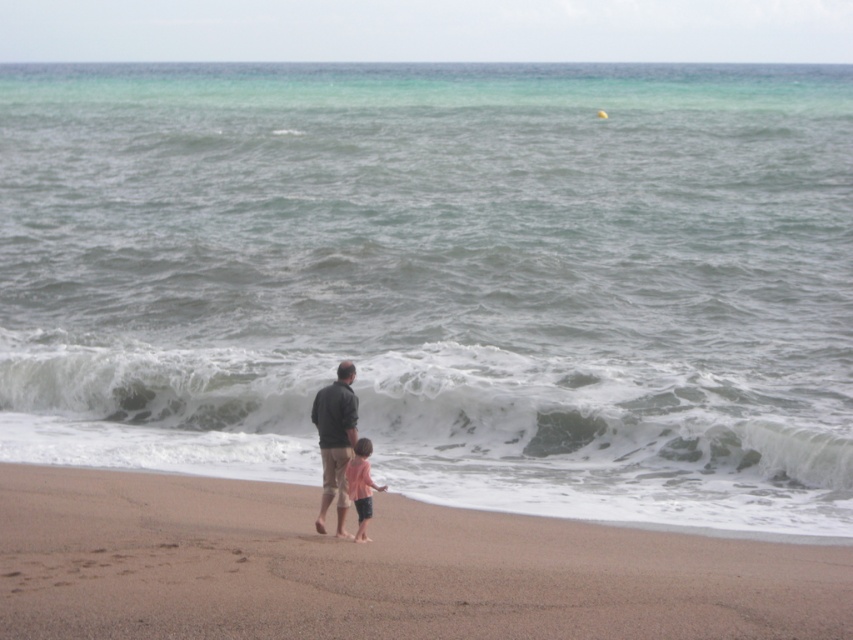
You are standing on the brown sandy beach at lower center and looking at the pink fabric shirt at lower center. Which object is taller?

The pink fabric shirt at lower center is taller than the brown sandy beach at lower center.

You are a photographer standing on the beach. You need to capture a photo where both the dark gray jacket at center and the pink fabric shirt at lower center are clearly visible. Which object should you focus on first to ensure both are in focus?

The dark gray jacket at center is taller than the pink fabric shirt at lower center. To ensure both are in focus, focus on the dark gray jacket at center first since it is taller and likely farther away, allowing the pink fabric shirt at lower center to fall within the depth of field.

You are standing on the beach and want to walk to both the point at coordinates (328, 448) and the point at (358, 520). Which point should you reach first if you want to minimize the distance walked?

You should reach the point at coordinates (328, 448) first because it is closer to you than the point at (358, 520).